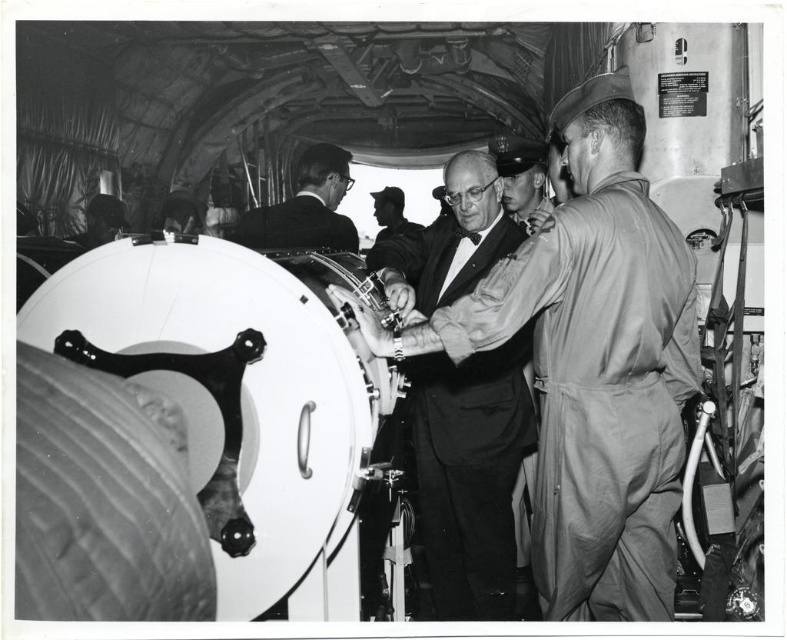
You are a technician standing 6 feet away from the camera. You need to reach the smooth black suit at center to inspect it. Can you reach it without moving closer?

The distance between the smooth black suit at center and the camera is 8.38 feet. Since you are 6 feet away from the camera, the total distance between you and the smooth black suit at center is 8.38 feet minus 6 feet, which equals 2.38 feet. Therefore, you can easily reach the smooth black suit at center without needing to move closer.

You are a technician in the aircraft and need to access the hyperbaric chamber. There are two people in the way, one wearing a smooth black suit at center and another in a dark blue uniform at center. Which person should you ask to step aside first?

You should ask the smooth black suit at center to step aside first because they are closer to the viewer than the dark blue uniform at center, so they are blocking the path more directly.